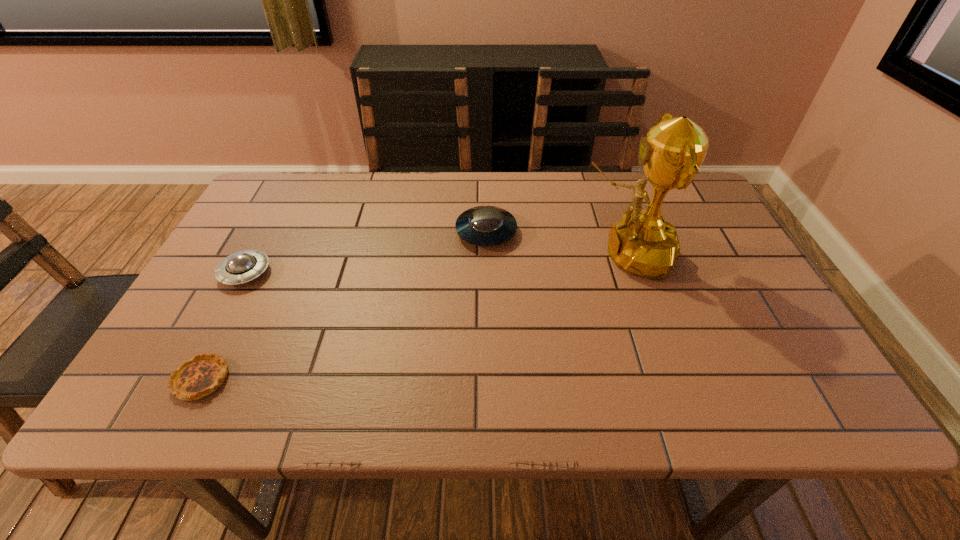
Image resolution: width=960 pixels, height=540 pixels. In order to click on vacant area at the left edge in this screenshot , I will do `click(207, 273)`.

This screenshot has height=540, width=960. Find the location of `vacant space at the far left corner`. vacant space at the far left corner is located at coordinates (300, 185).

The width and height of the screenshot is (960, 540). In the image, there is a desktop. Find the location of `vacant area at the far right corner`. vacant area at the far right corner is located at coordinates (677, 212).

Locate an element on the screen. The width and height of the screenshot is (960, 540). vacant area at the near right corner of the desktop is located at coordinates (777, 389).

Find the location of a particular element. vacant region between the award and the nearest object is located at coordinates (414, 316).

You are a GUI agent. You are given a task and a screenshot of the screen. Output one action in this format:
    pyautogui.click(x=<x>, y=<y>)
    Task: Click on the free spot between the tallest object and the right saucer
    Image resolution: width=960 pixels, height=540 pixels.
    Given the screenshot: What is the action you would take?
    pyautogui.click(x=556, y=243)

The height and width of the screenshot is (540, 960). I want to click on free space between the rightmost object and the shortest object, so click(x=414, y=316).

Locate an element on the screen. free point between the left saucer and the farther saucer is located at coordinates (366, 252).

The height and width of the screenshot is (540, 960). I want to click on free space that is in between the right saucer and the tallest object, so pos(556,243).

Image resolution: width=960 pixels, height=540 pixels. I want to click on free space that is in between the nearer saucer and the nearest object, so click(223, 326).